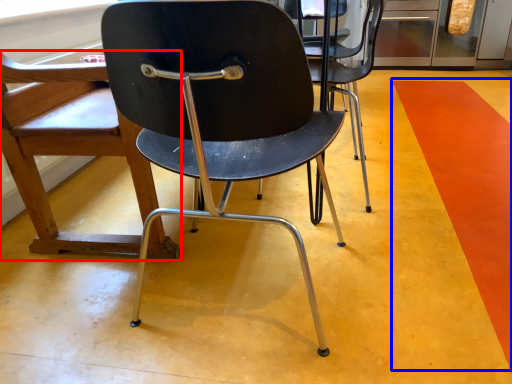
Question: Among these objects, which one is farthest to the camera, chair (highlighted by a red box) or strip (highlighted by a blue box)?

Choices:
 (A) chair
 (B) strip

Answer: (A)